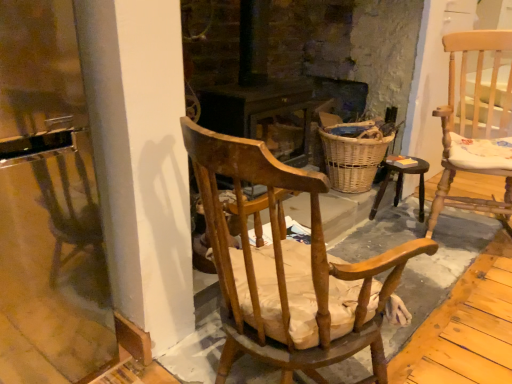
What do you see at coordinates (286, 267) in the screenshot? I see `wooden chair with cushion at center, which appears as the second chair when viewed from the back` at bounding box center [286, 267].

Locate an element on the screen. This screenshot has height=384, width=512. wooden stool at center is located at coordinates (x=401, y=184).

Find the location of a particular element. Image resolution: width=512 pixels, height=384 pixels. woven wicker basket at center is located at coordinates (353, 154).

Which object is positioned more to the left, woven wicker basket at center or wooden chair with cushion at center, the first chair viewed from the left?

wooden chair with cushion at center, the first chair viewed from the left, is more to the left.

Could wooden chair with cushion at center, which appears as the second chair when viewed from the back, be considered to be inside woven wicker basket at center?

No.

Can you see woven wicker basket at center touching wooden chair with cushion at center, which appears as the second chair when viewed from the back?

→ woven wicker basket at center and wooden chair with cushion at center, which appears as the second chair when viewed from the back, are clearly separated.

From a real-world perspective, between woven wicker basket at center and wooden chair with cushion at center, which appears as the second chair when viewed from the back, who is vertically higher?

wooden chair with cushion at center, which appears as the second chair when viewed from the back.

Can you confirm if wooden stool at center is wider than woven wicker basket at center?

In fact, wooden stool at center might be narrower than woven wicker basket at center.

Is woven wicker basket at center located within wooden stool at center?

No, woven wicker basket at center is not a part of wooden stool at center.

Would you say wooden stool at center is to the left or to the right of woven wicker basket at center in the picture?

Clearly, wooden stool at center is on the right of woven wicker basket at center in the image.

Is wooden stool at center positioned behind woven wicker basket at center?

Yes.

Who is taller, wooden chair with cushion at center, positioned as the 1th chair in front-to-back order, or woven wicker basket at center?

With more height is wooden chair with cushion at center, positioned as the 1th chair in front-to-back order.

Which of these two, wooden chair with cushion at center, positioned as the 1th chair in front-to-back order, or woven wicker basket at center, is thinner?

woven wicker basket at center is thinner.

Is wooden chair with cushion at center, the first chair viewed from the left, far away from woven wicker basket at center?

Yes, wooden chair with cushion at center, the first chair viewed from the left, is far from woven wicker basket at center.

Does point (312, 172) appear closer or farther from the camera than point (362, 168)?

Point (312, 172) is positioned closer to the camera compared to point (362, 168).

Considering the relative positions of wooden stool at center and wooden chair with cushion at center, which is the second chair in right-to-left order, in the image provided, is wooden stool at center behind wooden chair with cushion at center, which is the second chair in right-to-left order,?

Yes, wooden stool at center is further from the camera.

From the image's perspective, is wooden stool at center positioned above or below wooden chair with cushion at center, which is the second chair in right-to-left order?

Clearly, from the image's perspective, wooden stool at center is above wooden chair with cushion at center, which is the second chair in right-to-left order.

Consider the image. Could you tell me if wooden stool at center is turned towards wooden chair with cushion at center, which is the second chair in right-to-left order?

Yes, wooden stool at center is facing wooden chair with cushion at center, which is the second chair in right-to-left order.

This screenshot has width=512, height=384. In order to click on basket that is in front of the wooden stool at center in this screenshot , I will do `click(353, 154)`.

What's the angular difference between woven wicker basket at center and wooden stool at center's facing directions?

The angle between the facing direction of woven wicker basket at center and the facing direction of wooden stool at center is 80.2 degrees.

Is woven wicker basket at center shorter than wooden stool at center?

No.

Would you say woven wicker basket at center is outside wooden stool at center?

Yes, woven wicker basket at center is not within wooden stool at center.

Does point (505, 61) come closer to viewer compared to point (399, 169)?

Yes, it is in front of point (399, 169).

Locate an element on the screen. chair above the wooden stool at center (from the image's perspective) is located at coordinates (476, 120).

From the image's perspective, is light wood cushioned chair at right, the 2th chair viewed from the left, located beneath wooden stool at center?

Incorrect, from the image's perspective, light wood cushioned chair at right, the 2th chair viewed from the left, is higher than wooden stool at center.

Is light wood cushioned chair at right, arranged as the 1th chair when viewed from the right, to the left of wooden stool at center from the viewer's perspective?

No.

Does woven wicker basket at center touch light wood cushioned chair at right, the first chair from the back?

No, woven wicker basket at center is not making contact with light wood cushioned chair at right, the first chair from the back.

Which is closer to the camera, (343, 181) or (506, 111)?

Point (506, 111)

In the image, there is a woven wicker basket at center. At what (x,y) coordinates should I click in order to perform the action: click on chair below it (from the image's perspective). Please return your answer as a coordinate pair (x, y). Looking at the image, I should click on 286,267.

In order to click on stool lying behind the woven wicker basket at center in this screenshot , I will do `click(401, 184)`.

Considering their positions, is woven wicker basket at center positioned further to light wood cushioned chair at right, the second chair viewed from the front, than wooden chair with cushion at center, which is the second chair in right-to-left order?

Result: wooden chair with cushion at center, which is the second chair in right-to-left order, lies further to light wood cushioned chair at right, the second chair viewed from the front, than the other object.

Which object lies further to the anchor point woven wicker basket at center, wooden stool at center or wooden chair with cushion at center, positioned as the 1th chair in front-to-back order?

wooden chair with cushion at center, positioned as the 1th chair in front-to-back order, is further to woven wicker basket at center.

When comparing their distances from wooden chair with cushion at center, which is the second chair in right-to-left order, does wooden stool at center or light wood cushioned chair at right, the first chair from the back, seem closer?

light wood cushioned chair at right, the first chair from the back.

Considering their positions, is light wood cushioned chair at right, arranged as the 1th chair when viewed from the right, positioned further to woven wicker basket at center than wooden stool at center?

Among the two, light wood cushioned chair at right, arranged as the 1th chair when viewed from the right, is located further to woven wicker basket at center.

Which object lies nearer to the anchor point light wood cushioned chair at right, the 2th chair viewed from the left, wooden stool at center or woven wicker basket at center?

wooden stool at center is closer to light wood cushioned chair at right, the 2th chair viewed from the left.

Estimate the real-world distances between objects in this image. Which object is further from wooden stool at center, woven wicker basket at center or wooden chair with cushion at center, which is the second chair in right-to-left order?

wooden chair with cushion at center, which is the second chair in right-to-left order, is further to wooden stool at center.

Estimate the real-world distances between objects in this image. Which object is closer to woven wicker basket at center, wooden chair with cushion at center, which appears as the second chair when viewed from the back, or wooden stool at center?

wooden stool at center is closer to woven wicker basket at center.

Which object lies further to the anchor point woven wicker basket at center, light wood cushioned chair at right, the second chair viewed from the front, or wooden chair with cushion at center, which appears as the second chair when viewed from the back?

wooden chair with cushion at center, which appears as the second chair when viewed from the back, is positioned further to the anchor woven wicker basket at center.

Find the location of a particular element. basket between light wood cushioned chair at right, the second chair viewed from the front, and wooden stool at center, along the z-axis is located at coordinates (353, 154).

Where is `chair between wooden chair with cushion at center, which appears as the second chair when viewed from the back, and woven wicker basket at center in the front-back direction`? Image resolution: width=512 pixels, height=384 pixels. chair between wooden chair with cushion at center, which appears as the second chair when viewed from the back, and woven wicker basket at center in the front-back direction is located at coordinates (476, 120).

Identify the location of basket between wooden chair with cushion at center, positioned as the 1th chair in front-to-back order, and wooden stool at center from front to back. (353, 154).

Identify the location of chair between wooden chair with cushion at center, which is the second chair in right-to-left order, and wooden stool at center in the front-back direction. This screenshot has height=384, width=512. (476, 120).